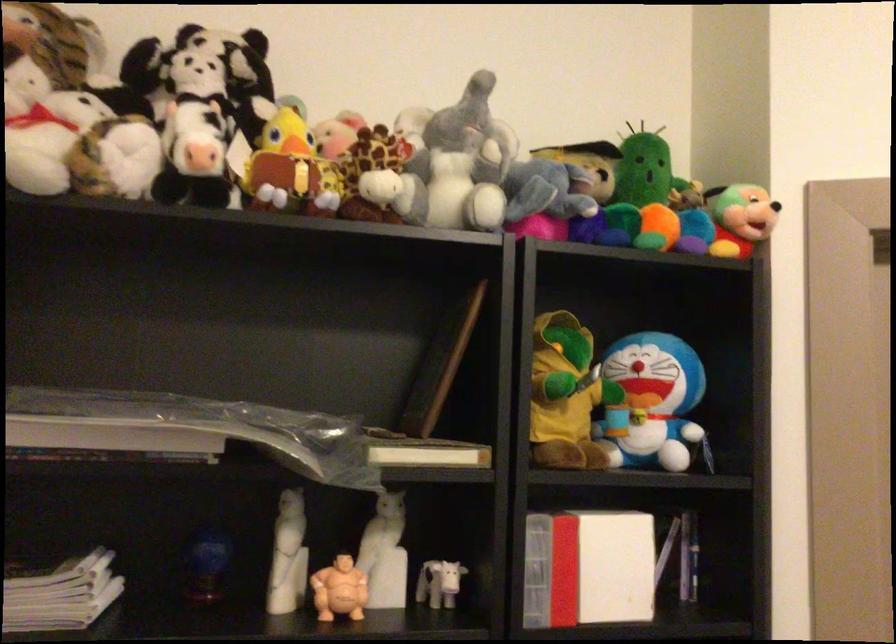
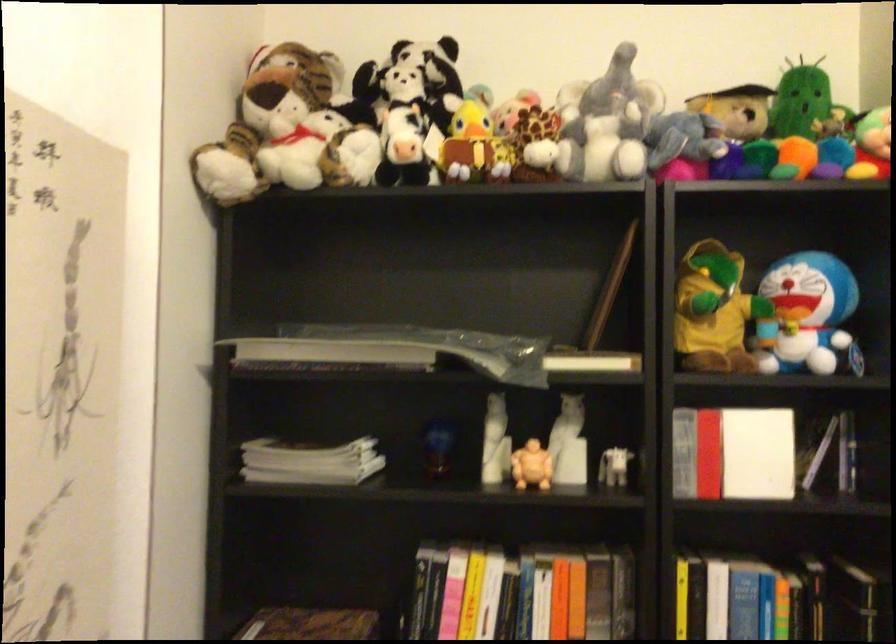
Where in the second image is the point corresponding to point (657, 402) from the first image?

(807, 317)